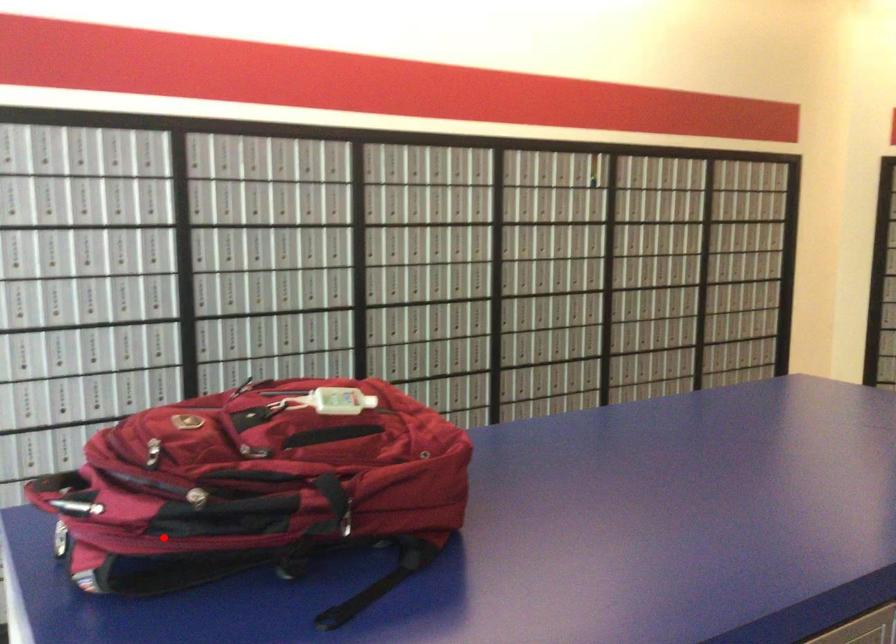
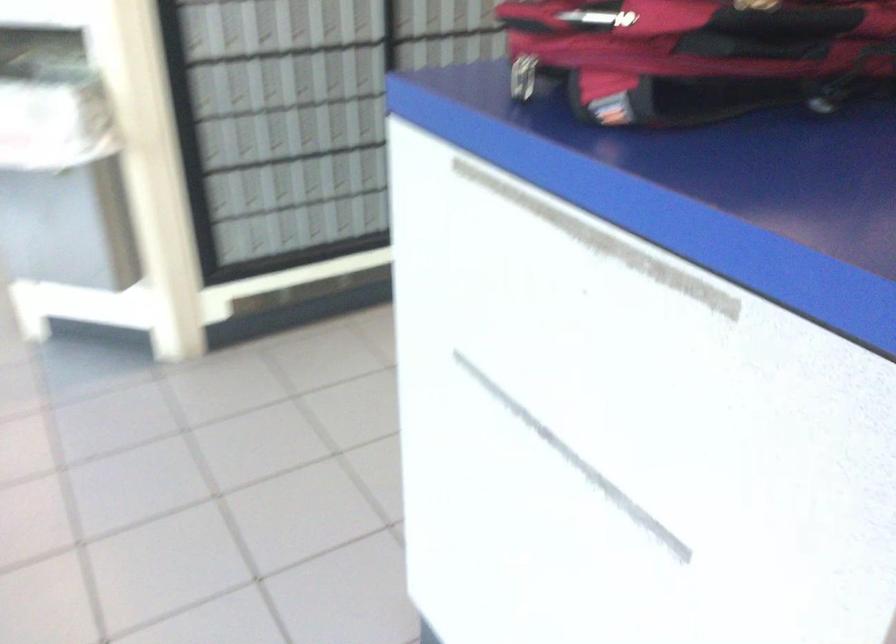
The point at the highlighted location is marked in the first image. Where is the corresponding point in the second image?

(696, 55)